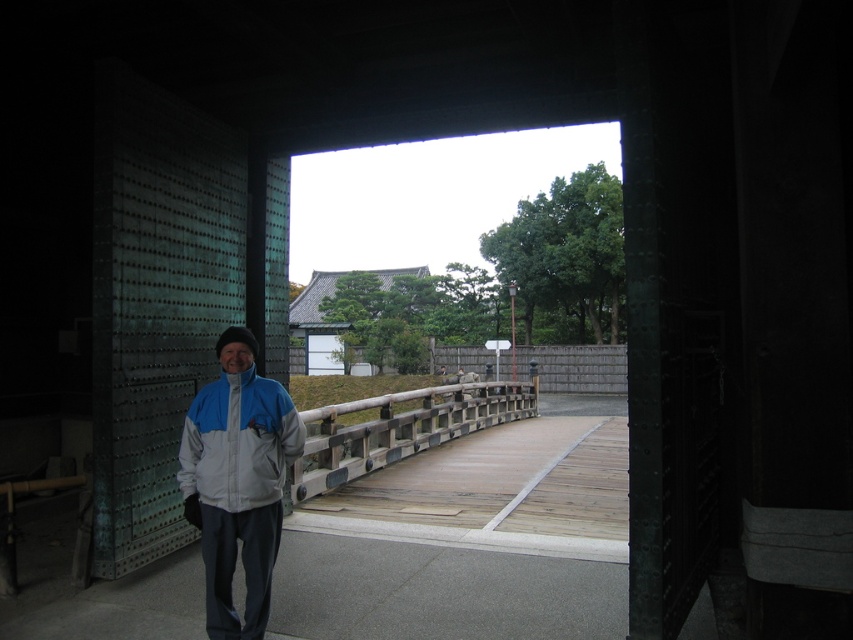
Based on the photo, how much distance is there between wooden textured rail at center and blue-gray fabric jacket at left?

3.96 meters

Between wooden textured rail at center and blue-gray fabric jacket at left, which one appears on the left side from the viewer's perspective?

From the viewer's perspective, blue-gray fabric jacket at left appears more on the left side.

The image size is (853, 640). What do you see at coordinates (398, 428) in the screenshot?
I see `wooden textured rail at center` at bounding box center [398, 428].

Where is `wooden textured rail at center`? The width and height of the screenshot is (853, 640). wooden textured rail at center is located at coordinates (398, 428).

Describe the element at coordinates (495, 490) in the screenshot. I see `wooden bridge at center` at that location.

Can you confirm if wooden bridge at center is wider than wooden textured rail at center?

Incorrect, wooden bridge at center's width does not surpass wooden textured rail at center's.

This screenshot has height=640, width=853. In order to click on wooden bridge at center in this screenshot , I will do `click(495, 490)`.

Find the location of a particular element. The image size is (853, 640). wooden bridge at center is located at coordinates (495, 490).

Does wooden bridge at center have a greater height compared to light blue fabric jacket at center?

No, wooden bridge at center is not taller than light blue fabric jacket at center.

Is wooden bridge at center smaller than light blue fabric jacket at center?

No.

This screenshot has height=640, width=853. Describe the element at coordinates (495, 490) in the screenshot. I see `wooden bridge at center` at that location.

This screenshot has width=853, height=640. In order to click on wooden bridge at center in this screenshot , I will do `click(495, 490)`.